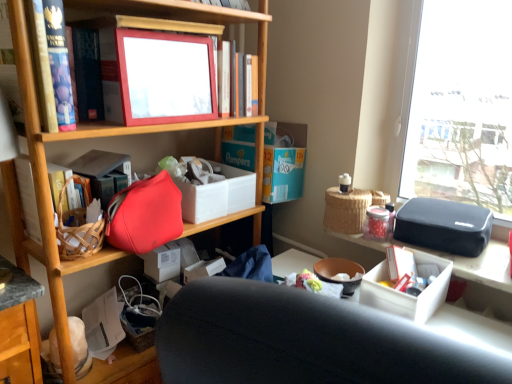
Question: In the image, is matte red handbag at center-left on the left side or the right side of matte plastic picture frame at upper center, marked as the 1th book in a right-to-left arrangement?

Choices:
 (A) right
 (B) left

Answer: (B)

Question: Does point (167, 190) appear closer or farther from the camera than point (222, 51)?

Choices:
 (A) closer
 (B) farther

Answer: (A)

Question: Which object is positioned farthest from the woven picnic basket at upper right?

Choices:
 (A) matte red handbag at center-left
 (B) matte plastic picture frame at upper center, marked as the 1th book in a right-to-left arrangement
 (C) matte plastic picture frame at upper center
 (D) white cardboard box at center
 (E) matte red book at left, arranged as the 2th book when viewed from the right

Answer: (E)

Question: Which object is positioned farthest from the white cardboard box at center?

Choices:
 (A) woven picnic basket at upper right
 (B) matte red handbag at center-left
 (C) matte plastic picture frame at upper center, marked as the 1th book in a right-to-left arrangement
 (D) matte red book at left, arranged as the 2th book when viewed from the right
 (E) matte plastic picture frame at upper center

Answer: (A)